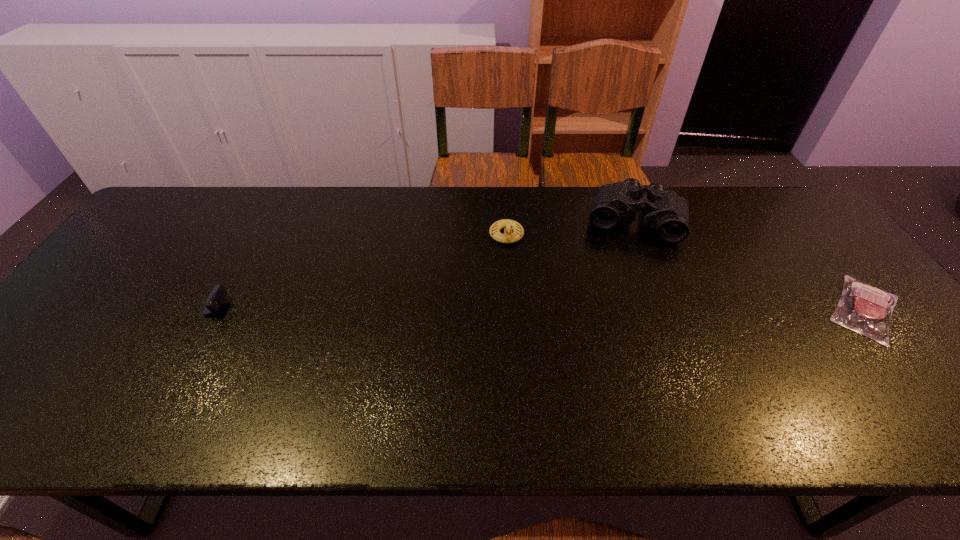
Find the location of a particular element. vacant area between the shortest object and the third tallest object is located at coordinates (522, 309).

Locate an element on the screen. This screenshot has width=960, height=540. vacant space that is in between the steak and the third object from right to left is located at coordinates 685,272.

Locate an element on the screen. This screenshot has height=540, width=960. free space between the tallest object and the second shortest object is located at coordinates (407, 266).

Identify the location of vacant space that's between the third shortest object and the leftmost object. click(344, 273).

This screenshot has width=960, height=540. I want to click on unoccupied area between the tallest object and the steak, so click(750, 265).

I want to click on vacant area between the binoculars and the duckling, so click(570, 228).

Find the location of `the second closest object to the third object from left to right`. the second closest object to the third object from left to right is located at coordinates (863, 308).

Select which object appears as the closest to the shortest object. Please provide its 2D coordinates. Your answer should be formatted as a tuple, i.e. [(x, y)], where the tuple contains the x and y coordinates of a point satisfying the conditions above.

[(665, 211)]

Locate an element on the screen. vacant space that satisfies the following two spatial constraints: 1. on the back side of the third object from left to right; 2. on the right side of the second tallest object is located at coordinates (506, 221).

This screenshot has height=540, width=960. I want to click on free location that satisfies the following two spatial constraints: 1. on the front side of the rightmost object; 2. on the left side of the binoculars, so click(669, 309).